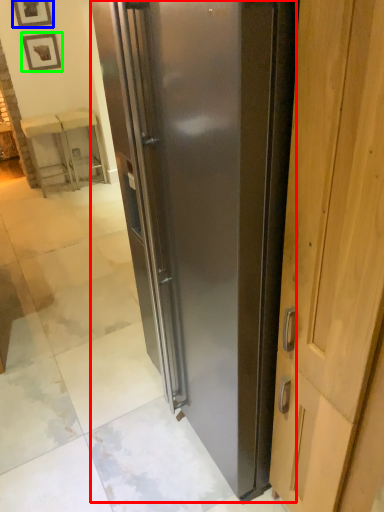
Question: Considering the real-world distances, which object is farthest from refrigerator (highlighted by a red box)? picture frame (highlighted by a blue box) or picture frame (highlighted by a green box)?

Choices:
 (A) picture frame
 (B) picture frame

Answer: (A)